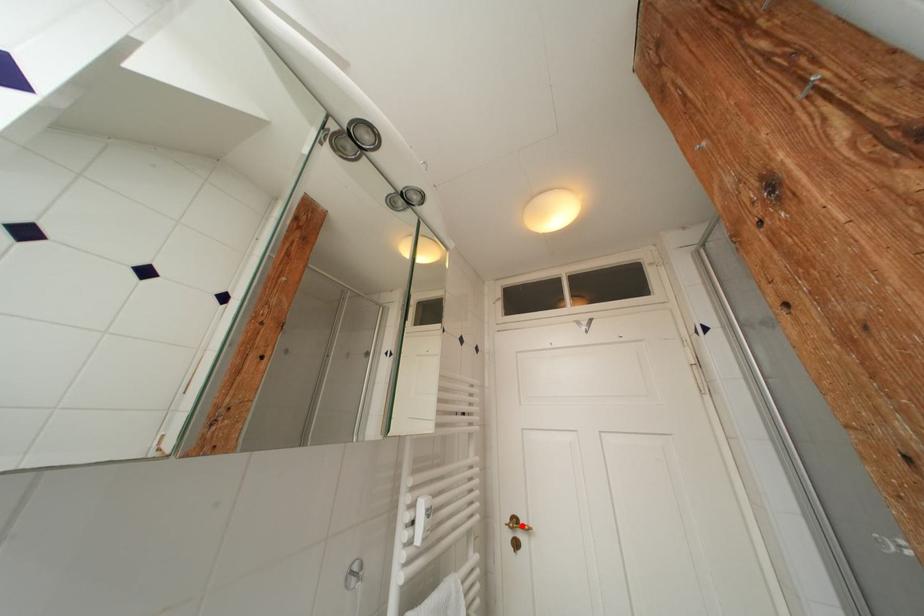
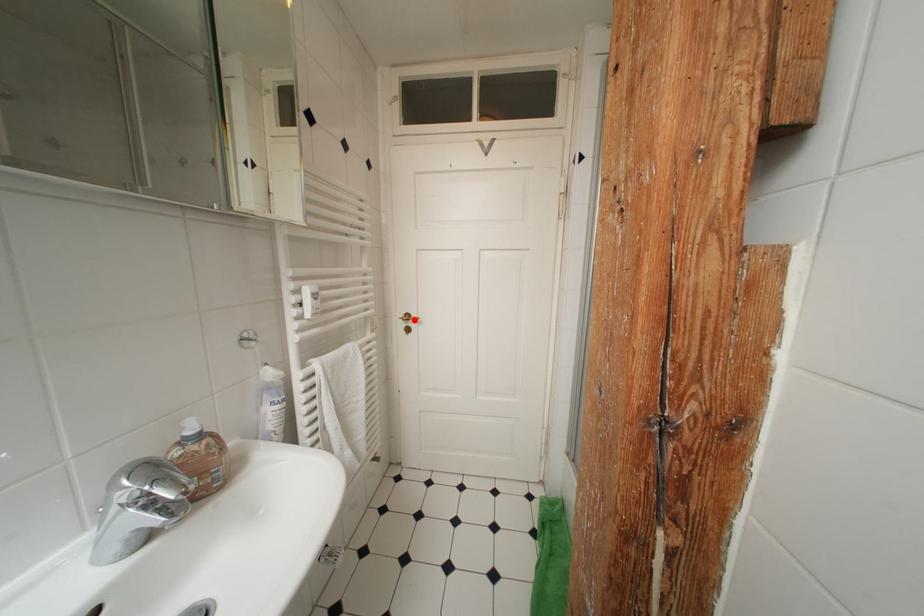
I am providing you with two images of the same scene from different viewpoints. A red point is marked on the first image and another point is marked on the second image. Is the red point in image1 aligned with the point shown in image2?

Yes